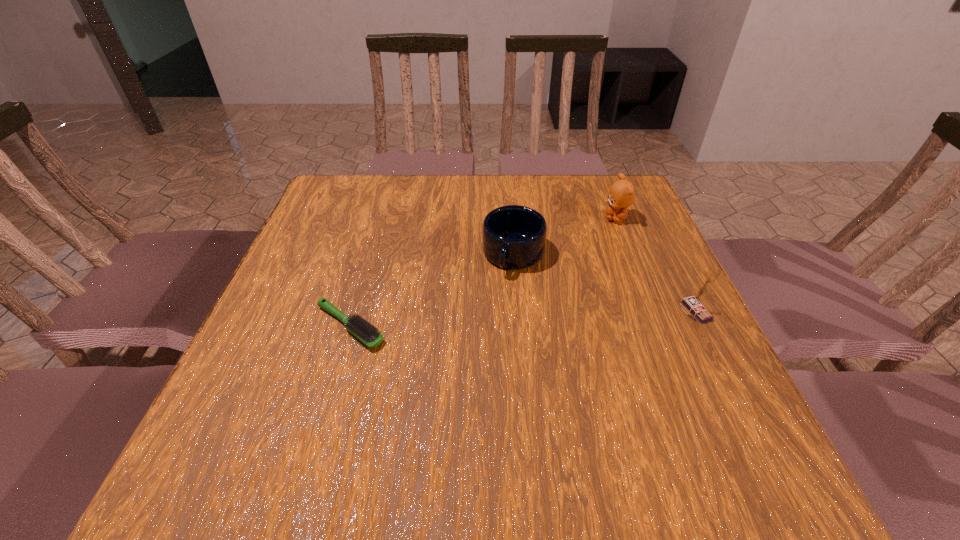
Find the location of a particular element. Image resolution: width=960 pixels, height=540 pixels. free spot at the far edge of the desktop is located at coordinates (500, 188).

Identify the location of free spot at the near edge of the desktop. The image size is (960, 540). (566, 418).

This screenshot has width=960, height=540. In the image, there is a desktop. What are the coordinates of `vacant space at the left edge` in the screenshot? It's located at (x=305, y=230).

The image size is (960, 540). What are the coordinates of `vacant space at the right edge of the desktop` in the screenshot? It's located at (615, 278).

Find the location of a particular element. The width and height of the screenshot is (960, 540). vacant region at the far left corner is located at coordinates (351, 199).

In the image, there is a desktop. At what (x,y) coordinates should I click in order to perform the action: click on vacant space at the near left corner. Please return your answer as a coordinate pair (x, y). Looking at the image, I should click on (229, 410).

In the image, there is a desktop. Where is `free space at the far right corner`? The image size is (960, 540). free space at the far right corner is located at coordinates (612, 185).

You are a GUI agent. You are given a task and a screenshot of the screen. Output one action in this format:
    pyautogui.click(x=<x>, y=<y>)
    Task: Click on the free space between the matchbox and the leftmost object
    Image resolution: width=960 pixels, height=540 pixels.
    Given the screenshot: What is the action you would take?
    pyautogui.click(x=522, y=319)

Locate an element on the screen. This screenshot has height=540, width=960. unoccupied position between the rightmost object and the mug is located at coordinates (604, 283).

I want to click on empty space between the farthest object and the shortest object, so click(x=483, y=272).